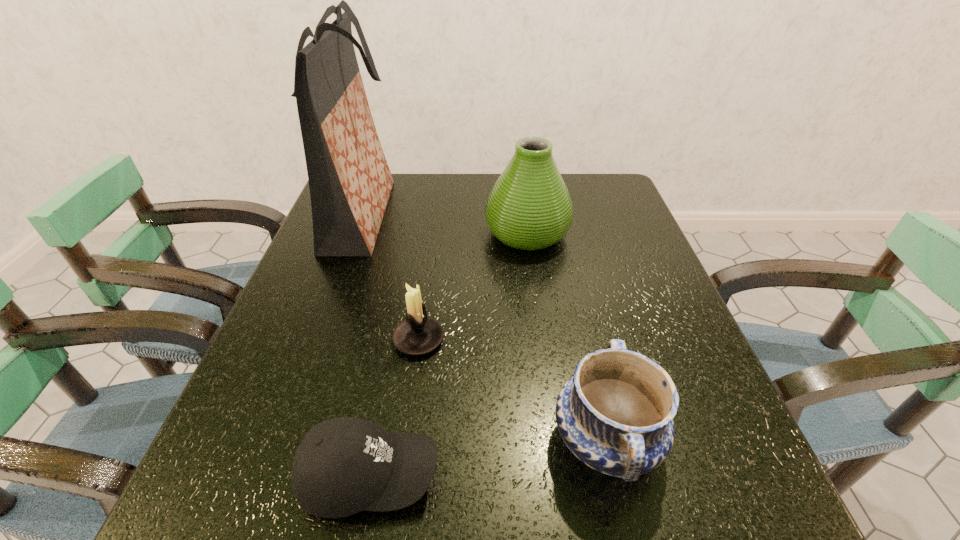
The width and height of the screenshot is (960, 540). What are the coordinates of `free space in the image that satisfies the following two spatial constraints: 1. on the front side of the fourth shortest object; 2. on the front-facing side of the baseball cap` in the screenshot? It's located at (561, 476).